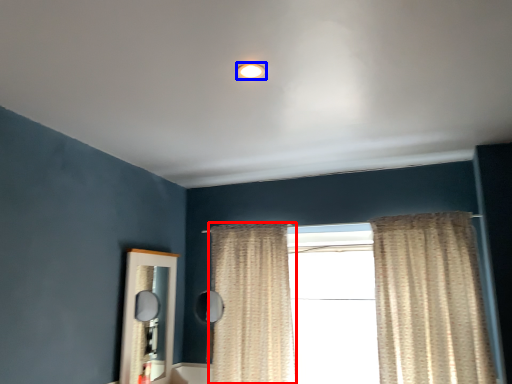
Question: Which object is closer to the camera taking this photo, curtain (highlighted by a red box) or lighting (highlighted by a blue box)?

Choices:
 (A) curtain
 (B) lighting

Answer: (B)